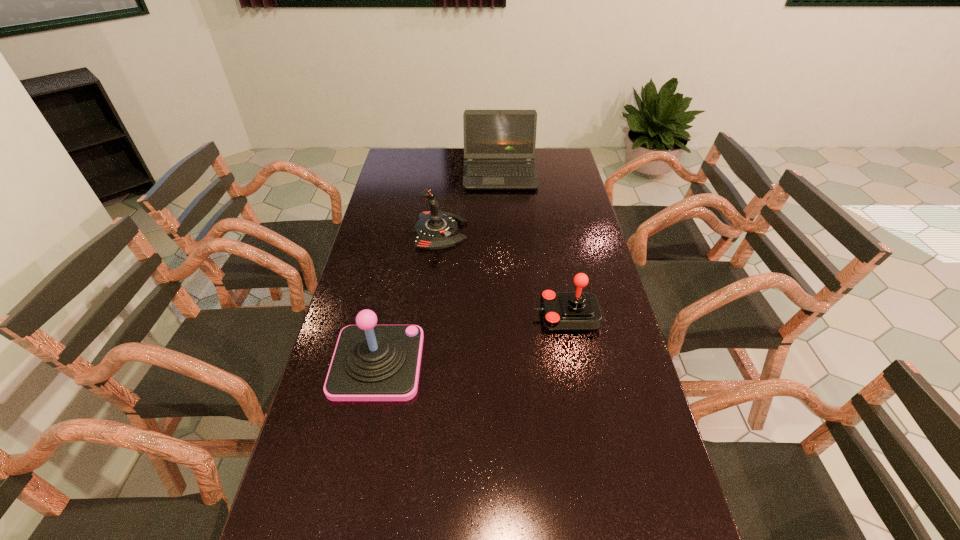
Locate which object ranks second in proximity to the farthest joystick. Please provide its 2D coordinates. Your answer should be formatted as a tuple, i.e. [(x, y)], where the tuple contains the x and y coordinates of a point satisfying the conditions above.

[(578, 311)]

Identify which object is the third nearest to the second farthest object. Please provide its 2D coordinates. Your answer should be formatted as a tuple, i.e. [(x, y)], where the tuple contains the x and y coordinates of a point satisfying the conditions above.

[(371, 362)]

Where is `joystick identified as the closest to the third nearest object`? The image size is (960, 540). joystick identified as the closest to the third nearest object is located at coordinates (578, 311).

I want to click on joystick that is the third nearest to the laptop_computer, so point(371,362).

Locate an element on the screen. free spot that satisfies the following two spatial constraints: 1. on the screen of the farthest object; 2. on the handle side of the third nearest object is located at coordinates (503, 232).